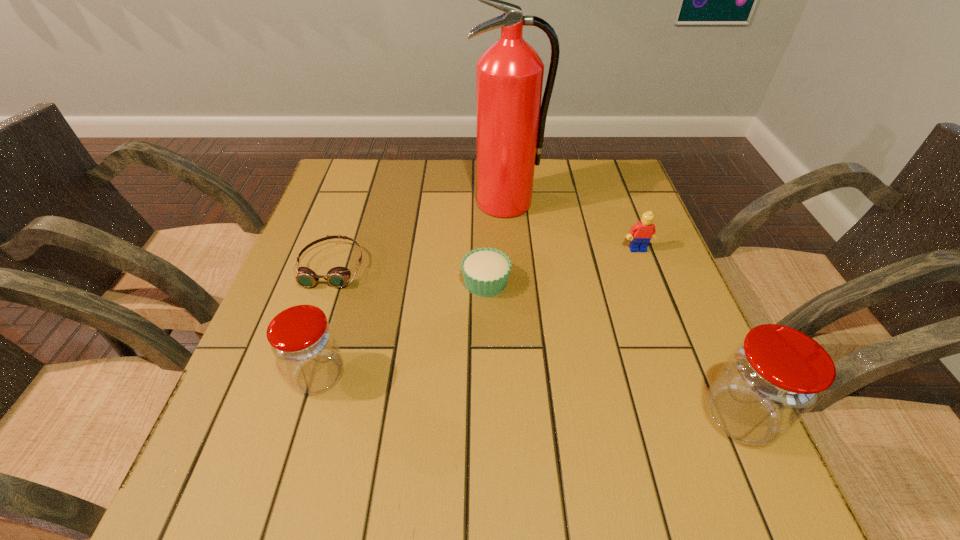
To make them evenly spaced by inserting another jar among them, please locate a free space for this new jar. Please provide its 2D coordinates. Your answer should be formatted as a tuple, i.e. [(x, y)], where the tuple contains the x and y coordinates of a point satisfying the conditions above.

[(521, 395)]